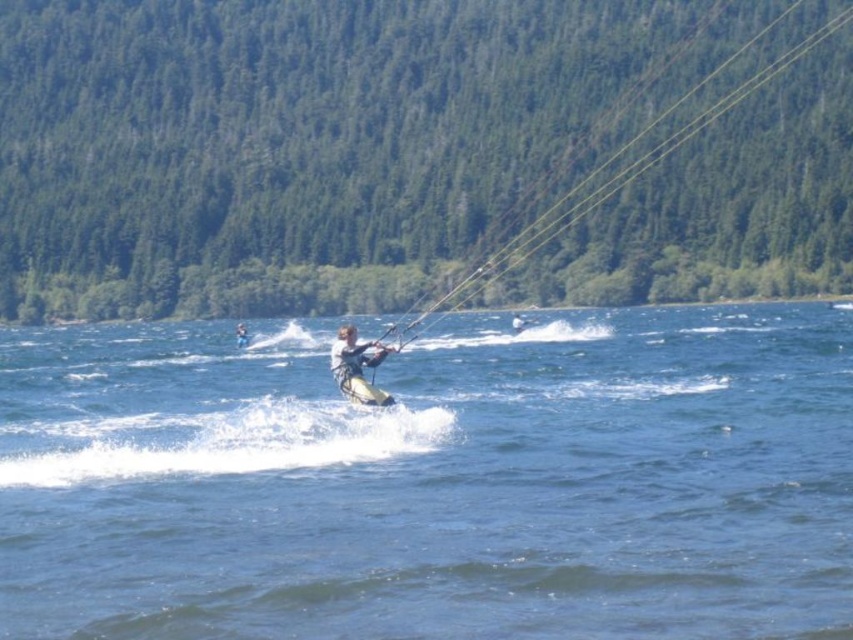
Question: Is green textured forest at upper center bigger than white matte kite surfer at center?

Choices:
 (A) no
 (B) yes

Answer: (B)

Question: Which point is farther to the camera?

Choices:
 (A) yellow-green wetsuit at center
 (B) blue water at center

Answer: (A)

Question: Does blue water at center appear over white matte kite surfer at center?

Choices:
 (A) no
 (B) yes

Answer: (B)

Question: Is blue water at center smaller than green textured forest at upper center?

Choices:
 (A) yes
 (B) no

Answer: (A)

Question: Based on their relative distances, which object is farther from the blue water at center?

Choices:
 (A) white matte kite surfer at center
 (B) green textured forest at upper center
 (C) yellow-green wetsuit at center

Answer: (B)

Question: Which of the following is the closest to the observer?

Choices:
 (A) (662, 493)
 (B) (344, 339)
 (C) (415, 156)
 (D) (248, 336)

Answer: (A)